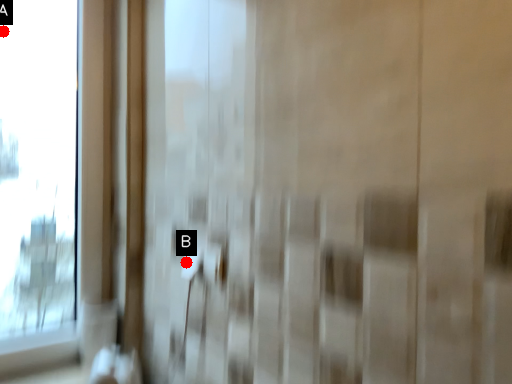
Question: Two points are circled on the image, labeled by A and B beside each circle. Which point is closer to the camera taking this photo?

Choices:
 (A) A is closer
 (B) B is closer

Answer: (B)